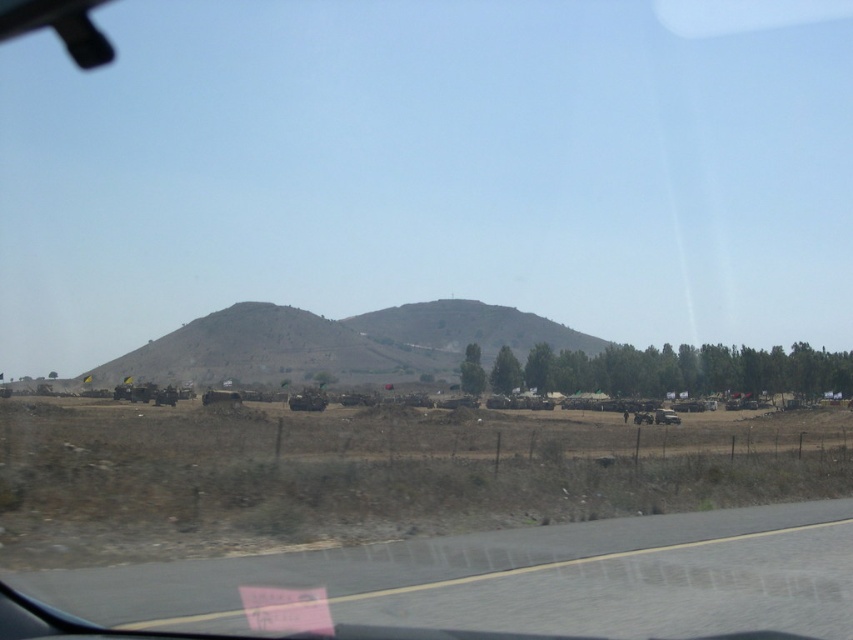
This screenshot has width=853, height=640. What do you see at coordinates (520, 579) in the screenshot? I see `gray asphalt highway at lower center` at bounding box center [520, 579].

Does gray asphalt highway at lower center lie behind brown textured hill at center?

No, it is in front of brown textured hill at center.

Locate an element on the screen. This screenshot has height=640, width=853. gray asphalt highway at lower center is located at coordinates (520, 579).

Locate an element on the screen. gray asphalt highway at lower center is located at coordinates (520, 579).